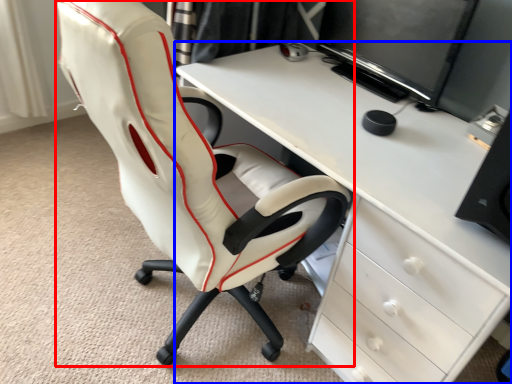
Question: Among these objects, which one is nearest to the camera, chair (highlighted by a red box) or desk (highlighted by a blue box)?

Choices:
 (A) chair
 (B) desk

Answer: (A)